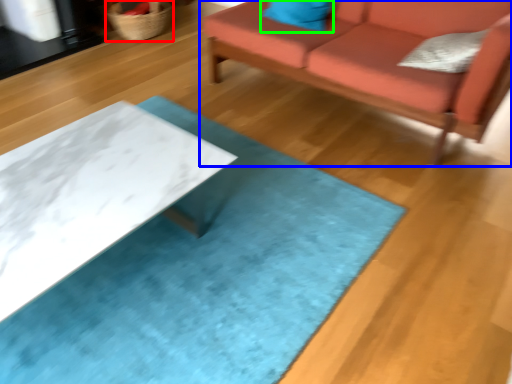
Question: Which is nearer to the basket (highlighted by a red box)? studio couch (highlighted by a blue box) or pillow (highlighted by a green box).

Choices:
 (A) studio couch
 (B) pillow

Answer: (B)